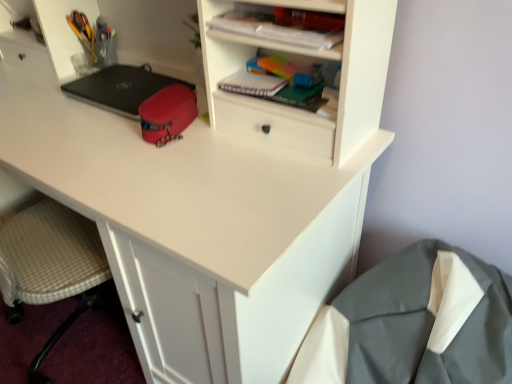
Question: Based on their positions, is plaid paper notebook at upper center located to the left or right of gray fabric sleeping bag at lower right?

Choices:
 (A) right
 (B) left

Answer: (B)

Question: From a real-world perspective, is plaid paper notebook at upper center positioned above or below gray fabric sleeping bag at lower right?

Choices:
 (A) above
 (B) below

Answer: (A)

Question: Estimate the real-world distances between objects in this image. Which object is closer to the gray fabric sleeping bag at lower right?

Choices:
 (A) metallic pen holder at upper left, the second stationery viewed from the front
 (B) black matte laptop at center
 (C) plaid paper notebook at upper center
 (D) matte red pouch at center, positioned as the 2th stationery in back-to-front order
 (E) matte plastic notebook at upper center

Answer: (C)

Question: Based on their relative distances, which object is farther from the black matte laptop at center?

Choices:
 (A) gray fabric sleeping bag at lower right
 (B) metallic pen holder at upper left, which is the second stationery from bottom to top
 (C) matte plastic notebook at upper center
 (D) matte red pouch at center, which appears as the 1th stationery when viewed from the front
 (E) plaid paper notebook at upper center

Answer: (A)